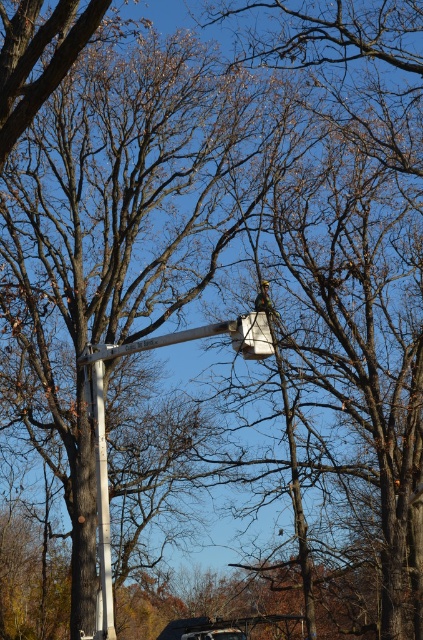
Can you confirm if white metallic street light at upper center is bigger than white plastic pole at center?

Indeed, white metallic street light at upper center has a larger size compared to white plastic pole at center.

Who is higher up, white metallic street light at upper center or white plastic pole at center?

white metallic street light at upper center

What do you see at coordinates (104, 432) in the screenshot? The width and height of the screenshot is (423, 640). I see `white metallic street light at upper center` at bounding box center [104, 432].

In order to click on white metallic street light at upper center in this screenshot , I will do `click(104, 432)`.